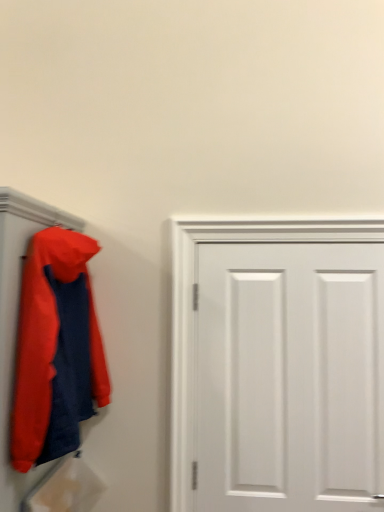
Question: From a real-world perspective, is matte orange jacket at left over white matte door at center?

Choices:
 (A) yes
 (B) no

Answer: (A)

Question: Considering the relative sizes of matte orange jacket at left and white matte door at center in the image provided, is matte orange jacket at left taller than white matte door at center?

Choices:
 (A) yes
 (B) no

Answer: (B)

Question: Is matte orange jacket at left surrounding white matte door at center?

Choices:
 (A) no
 (B) yes

Answer: (A)

Question: From the image's perspective, is matte orange jacket at left below white matte door at center?

Choices:
 (A) no
 (B) yes

Answer: (A)

Question: Is the position of matte orange jacket at left more distant than that of white matte door at center?

Choices:
 (A) yes
 (B) no

Answer: (B)

Question: Considering the relative sizes of matte orange jacket at left and white matte door at center in the image provided, is matte orange jacket at left smaller than white matte door at center?

Choices:
 (A) yes
 (B) no

Answer: (B)

Question: Considering the relative sizes of white matte door at center and matte orange jacket at left in the image provided, is white matte door at center shorter than matte orange jacket at left?

Choices:
 (A) yes
 (B) no

Answer: (B)

Question: Is white matte door at center wider than matte orange jacket at left?

Choices:
 (A) no
 (B) yes

Answer: (A)

Question: From a real-world perspective, is white matte door at center under matte orange jacket at left?

Choices:
 (A) yes
 (B) no

Answer: (A)

Question: Does white matte door at center have a lesser width compared to matte orange jacket at left?

Choices:
 (A) no
 (B) yes

Answer: (B)

Question: Would you say white matte door at center is a long distance from matte orange jacket at left?

Choices:
 (A) no
 (B) yes

Answer: (A)

Question: Is white matte door at center further to the viewer compared to matte orange jacket at left?

Choices:
 (A) yes
 (B) no

Answer: (A)

Question: From their relative heights in the image, would you say matte orange jacket at left is taller or shorter than white matte door at center?

Choices:
 (A) short
 (B) tall

Answer: (A)